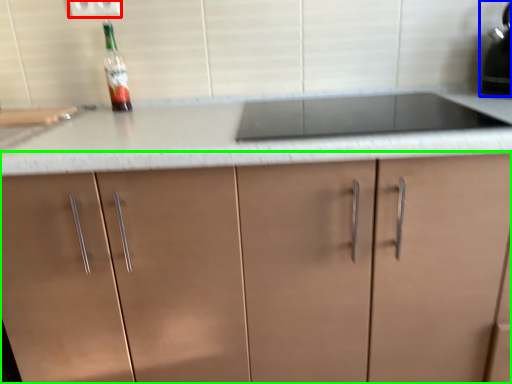
Question: Which object is positioned farthest from electric outlet (highlighted by a red box)? Select from kitchen appliance (highlighted by a blue box) and cabinetry (highlighted by a green box).

Choices:
 (A) kitchen appliance
 (B) cabinetry

Answer: (A)